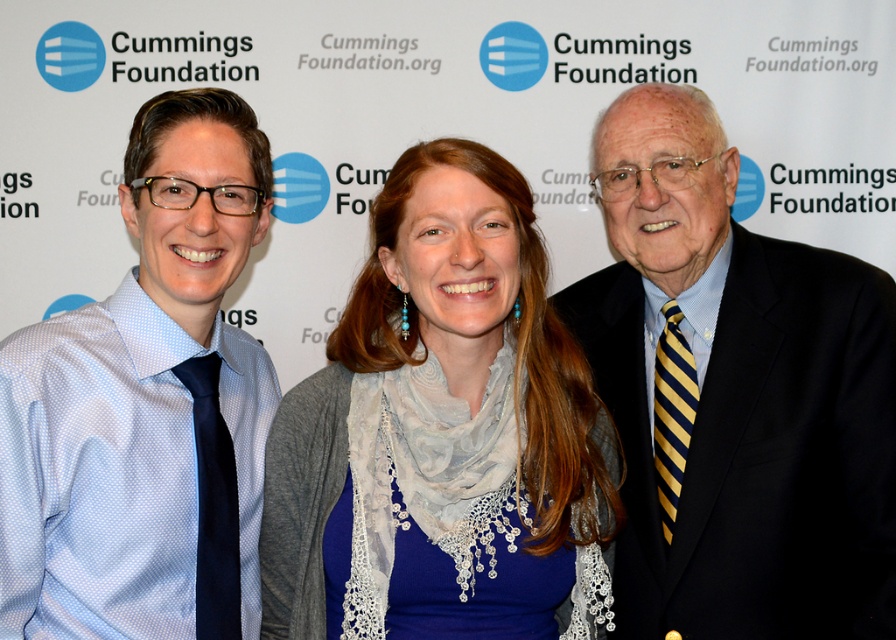
The image size is (896, 640). Describe the element at coordinates (145, 406) in the screenshot. I see `matte blue shirt at left` at that location.

Which is in front, point (67, 636) or point (461, 605)?

Point (461, 605) is in front.

Where is `matte blue shirt at left`? This screenshot has width=896, height=640. matte blue shirt at left is located at coordinates (145, 406).

Which is behind, point (757, 257) or point (303, 532)?

Point (757, 257)

Does point (711, 317) come farther from viewer compared to point (461, 621)?

Yes, it is behind point (461, 621).

I want to click on black suit at center, so click(x=735, y=396).

Where is `black suit at center`? black suit at center is located at coordinates (735, 396).

Between point (808, 596) and point (151, 598), which one is positioned behind?

The point (808, 596) is behind.

Does point (756, 531) come behind point (204, 136)?

Yes, point (756, 531) is farther from viewer.

This screenshot has width=896, height=640. In order to click on black suit at center in this screenshot , I will do `click(735, 396)`.